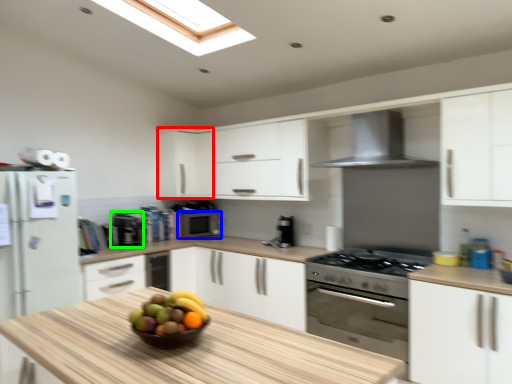
Question: Which is farther away from cabinetry (highlighted by a red box)? appliance (highlighted by a blue box) or appliance (highlighted by a green box)?

Choices:
 (A) appliance
 (B) appliance

Answer: (B)